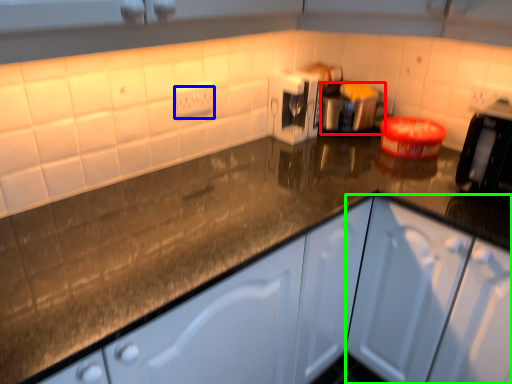
Question: Based on their relative distances, which object is farther from appliance (highlighted by a red box)? Choose from electric outlet (highlighted by a blue box) and cabinetry (highlighted by a green box).

Choices:
 (A) electric outlet
 (B) cabinetry

Answer: (B)